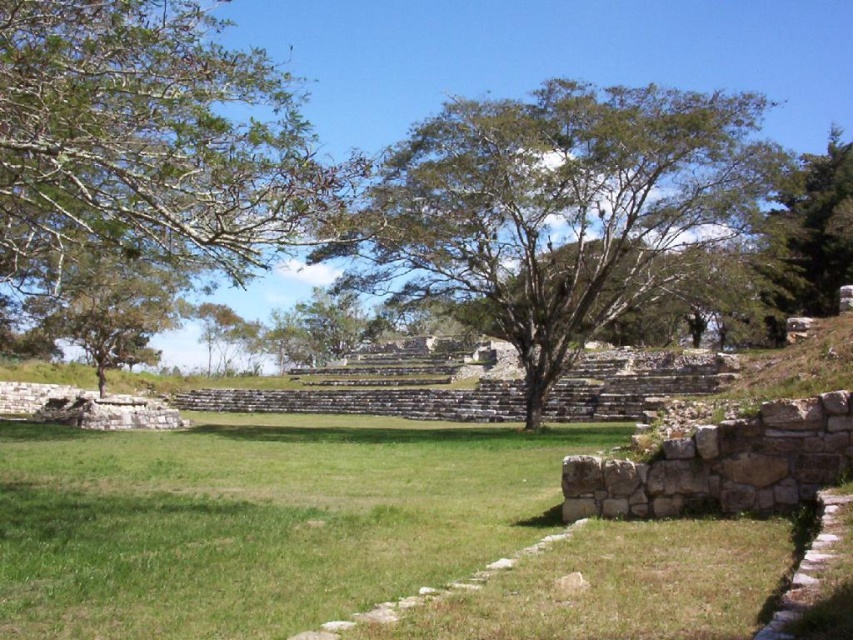
Who is more forward, (769, 180) or (790, 198)?

Point (769, 180) is in front.

Is point (357, 276) positioned behind point (752, 259)?

Yes, point (357, 276) is farther from viewer.

Between point (737, 170) and point (780, 337), which one is positioned behind?

The point (780, 337) is more distant.

You are a GUI agent. You are given a task and a screenshot of the screen. Output one action in this format:
    pyautogui.click(x=<x>, y=<y>)
    Task: Click on the green leafy tree at center
    This screenshot has height=640, width=853.
    Given the screenshot: What is the action you would take?
    pyautogui.click(x=560, y=211)

Is green leafy tree at center shorter than green leafy tree at upper left?

In fact, green leafy tree at center may be taller than green leafy tree at upper left.

Can you confirm if green leafy tree at center is positioned above green leafy tree at upper left?

No, green leafy tree at center is not above green leafy tree at upper left.

Who is more forward, (500, 200) or (207, 168)?

Point (207, 168) is more forward.

Find the location of a particular element. This screenshot has height=640, width=853. green leafy tree at center is located at coordinates (560, 211).

Does green leafy tree at upper left appear on the right side of green leafy tree at left?

Correct, you'll find green leafy tree at upper left to the right of green leafy tree at left.

Who is more forward, [4,29] or [138,268]?

Point [4,29] is more forward.

This screenshot has height=640, width=853. Identify the location of green leafy tree at upper left. (149, 141).